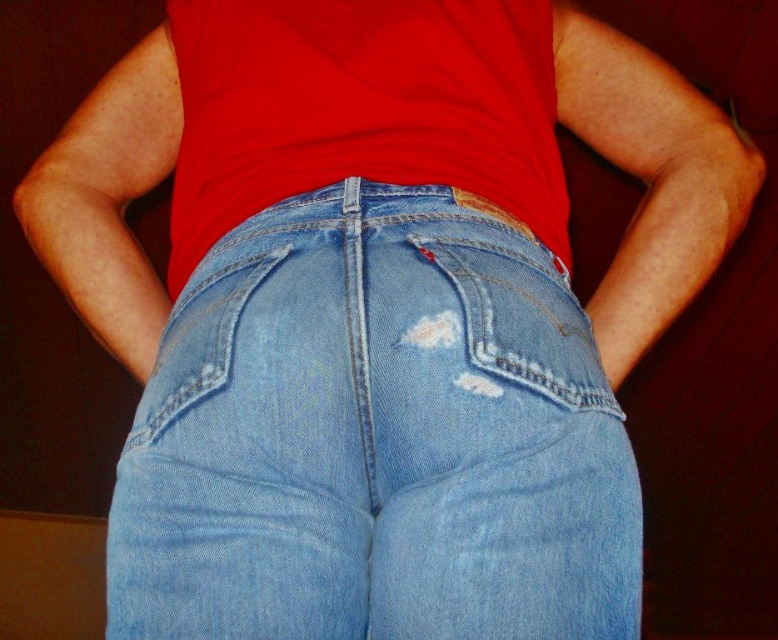
Consider the image. Between matte red t-shirt at center and ripped denim pocket at center, which one is positioned lower?

ripped denim pocket at center is lower down.

Locate an element on the screen. The width and height of the screenshot is (778, 640). matte red t-shirt at center is located at coordinates (361, 108).

Who is more distant from viewer, (x=412, y=612) or (x=440, y=342)?

The point (x=440, y=342) is behind.

Is light blue denim jeans at center to the right of ripped denim pocket at center from the viewer's perspective?

No, light blue denim jeans at center is not to the right of ripped denim pocket at center.

What do you see at coordinates (375, 438) in the screenshot? This screenshot has width=778, height=640. I see `light blue denim jeans at center` at bounding box center [375, 438].

What are the coordinates of `light blue denim jeans at center` in the screenshot? It's located at (375, 438).

How much distance is there between light blue denim jeans at center and matte red t-shirt at center?

light blue denim jeans at center and matte red t-shirt at center are 5.48 inches apart.

Can you confirm if light blue denim jeans at center is taller than matte red t-shirt at center?

Yes, light blue denim jeans at center is taller than matte red t-shirt at center.

You are a GUI agent. You are given a task and a screenshot of the screen. Output one action in this format:
    pyautogui.click(x=<x>, y=<y>)
    Task: Click on the light blue denim jeans at center
    
    Given the screenshot: What is the action you would take?
    pyautogui.click(x=375, y=438)

In order to click on light blue denim jeans at center in this screenshot , I will do (375, 438).